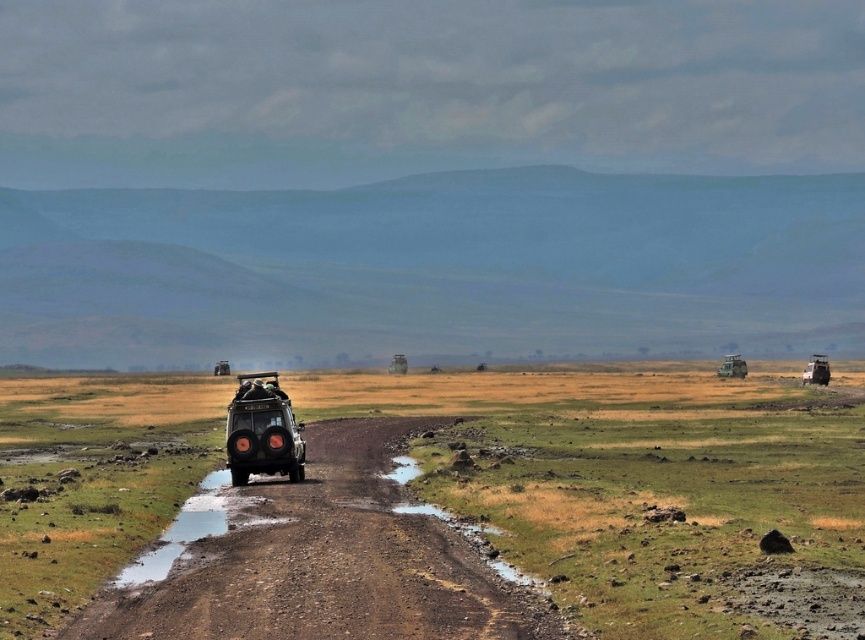
Does brown dirt track at center appear under matte green truck at center-right?

Yes, brown dirt track at center is below matte green truck at center-right.

Which of these two, brown dirt track at center or matte green truck at center-right, stands taller?

matte green truck at center-right

Is point (248, 596) closer to viewer compared to point (735, 364)?

Yes.

Where is `brown dirt track at center`? brown dirt track at center is located at coordinates (325, 561).

Can you confirm if green grassland at center is positioned above matte black jeep at right?

No.

Where is `green grassland at center`? green grassland at center is located at coordinates (635, 476).

At what (x,y) coordinates should I click in order to perform the action: click on green grassland at center. Please return your answer as a coordinate pair (x, y). This screenshot has width=865, height=640. Looking at the image, I should click on (635, 476).

Between matte black jeep at center and matte green truck at center-right, which one appears on the right side from the viewer's perspective?

matte green truck at center-right is more to the right.

Is point (287, 400) closer to viewer compared to point (741, 371)?

That is True.

Where is `matte black jeep at center`? matte black jeep at center is located at coordinates (263, 433).